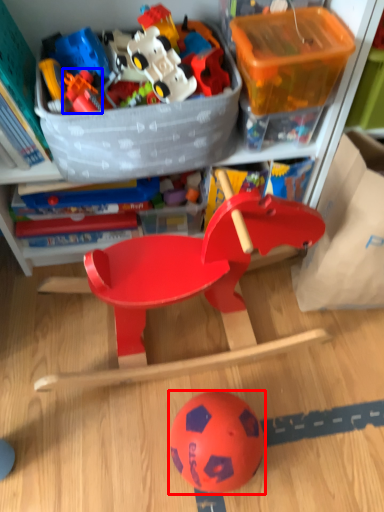
Question: Which object is closer to the camera taking this photo, ball (highlighted by a red box) or toy (highlighted by a blue box)?

Choices:
 (A) ball
 (B) toy

Answer: (A)